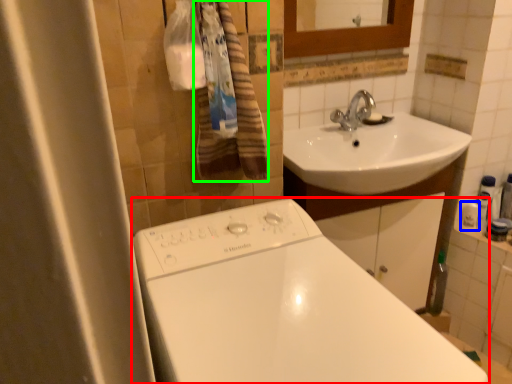
Question: Considering the real-world distances, which object is farthest from bathtub (highlighted by a red box)? toiletry (highlighted by a blue box) or bath towel (highlighted by a green box)?

Choices:
 (A) toiletry
 (B) bath towel

Answer: (A)